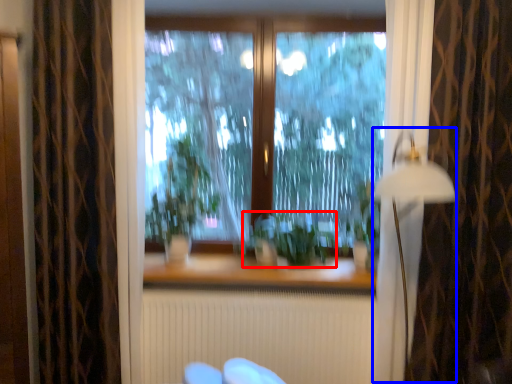
Question: Which point is further to the camera, plant (highlighted by a red box) or lamp (highlighted by a blue box)?

Choices:
 (A) plant
 (B) lamp

Answer: (A)